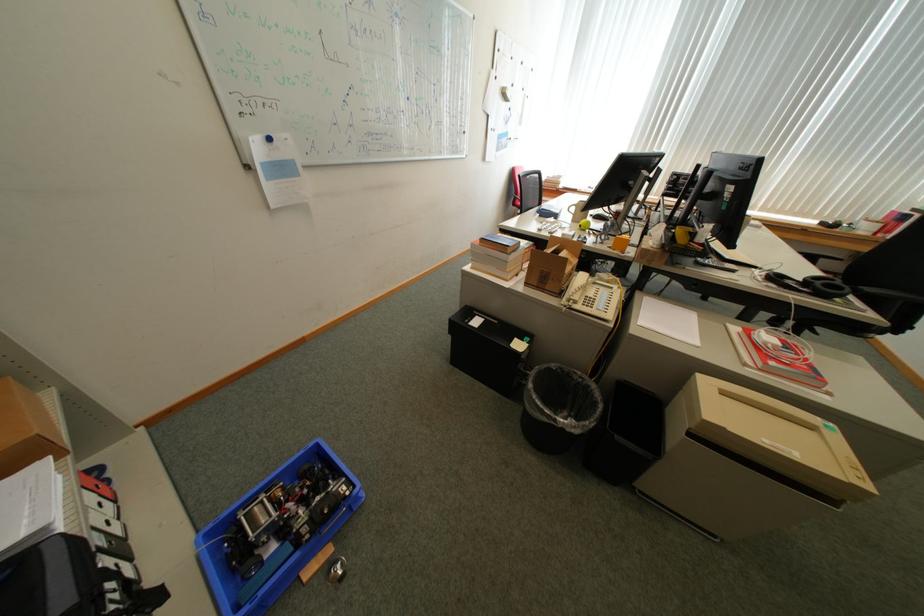
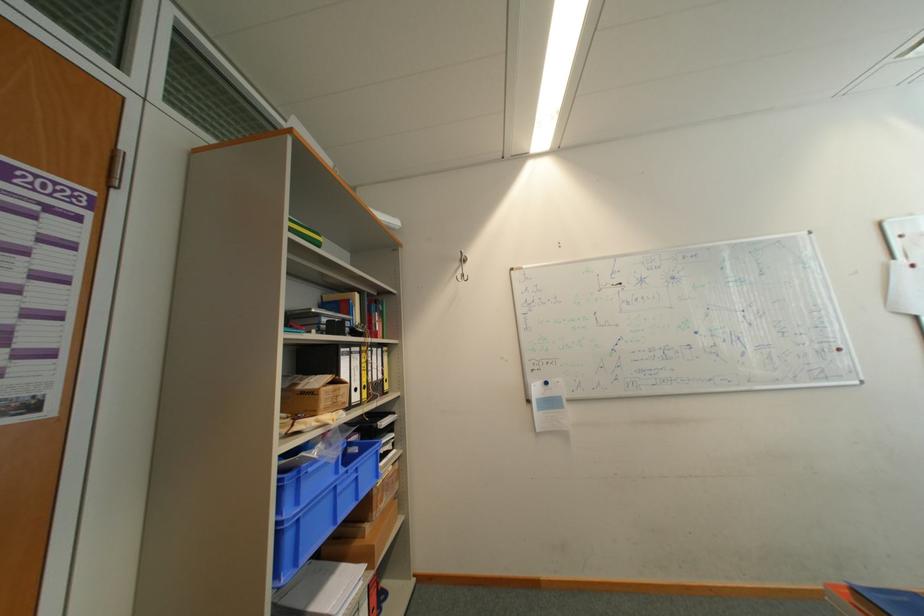
How did the camera likely rotate?

The camera rotated toward left-up.